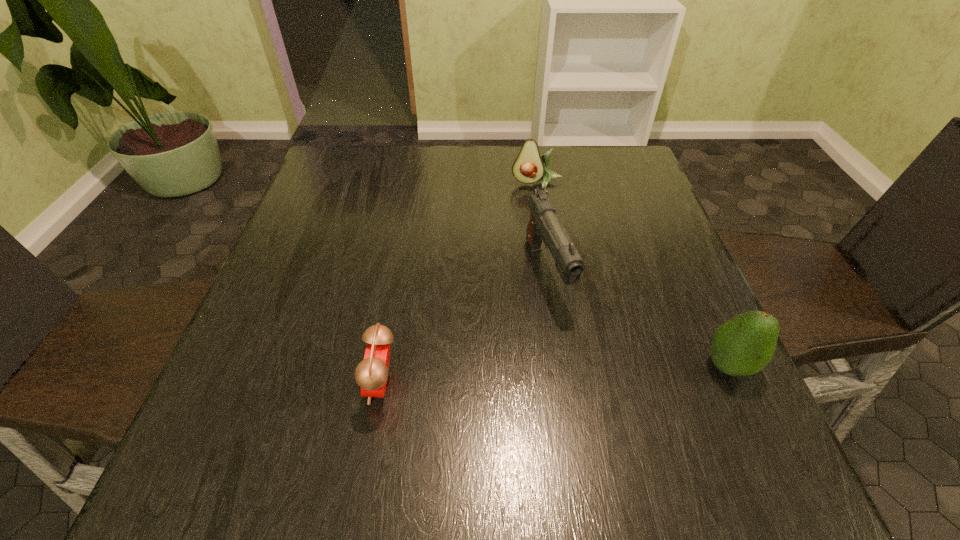
The image size is (960, 540). Find the location of `the leftmost object`. the leftmost object is located at coordinates (371, 374).

Where is `the right avocado`? the right avocado is located at coordinates (743, 345).

At what (x,y) coordinates should I click in order to perform the action: click on the nearer avocado. Please return your answer as a coordinate pair (x, y). The height and width of the screenshot is (540, 960). Looking at the image, I should click on (743, 345).

Image resolution: width=960 pixels, height=540 pixels. What are the coordinates of `the farthest object` in the screenshot? It's located at (529, 167).

Locate an element on the screen. Image resolution: width=960 pixels, height=540 pixels. the farther avocado is located at coordinates (529, 167).

Where is `the third nearest object`? the third nearest object is located at coordinates tap(544, 225).

The image size is (960, 540). What are the coordinates of `vacant space situated on the clock face of the alarm clock` in the screenshot? It's located at (302, 384).

At what (x,y) coordinates should I click in order to perform the action: click on vacant area located on the clock face of the alarm clock. Please return your answer as a coordinate pair (x, y). This screenshot has width=960, height=540. Looking at the image, I should click on pos(285,384).

This screenshot has width=960, height=540. In order to click on vacant point located 0.130m on the clock face of the alarm clock in this screenshot , I will do `click(291, 384)`.

You are a GUI agent. You are given a task and a screenshot of the screen. Output one action in this format:
    pyautogui.click(x=<x>, y=<y>)
    Task: Click on the free space located 0.130m on the left of the nearer avocado
    This screenshot has height=540, width=960.
    Given the screenshot: What is the action you would take?
    pyautogui.click(x=630, y=365)